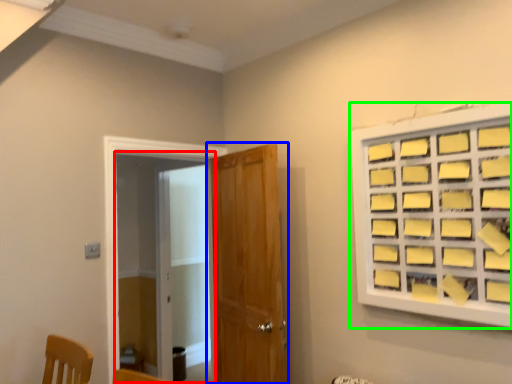
Question: Estimate the real-world distances between objects in this image. Which object is farther from screen door (highlighted by a red box), door (highlighted by a blue box) or window (highlighted by a green box)?

Choices:
 (A) door
 (B) window

Answer: (B)